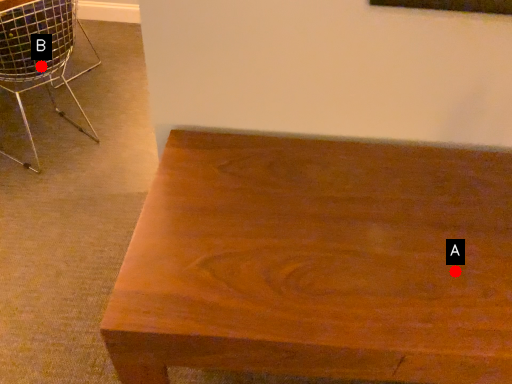
Question: Two points are circled on the image, labeled by A and B beside each circle. Which point is farther from the camera taking this photo?

Choices:
 (A) A is further
 (B) B is further

Answer: (B)